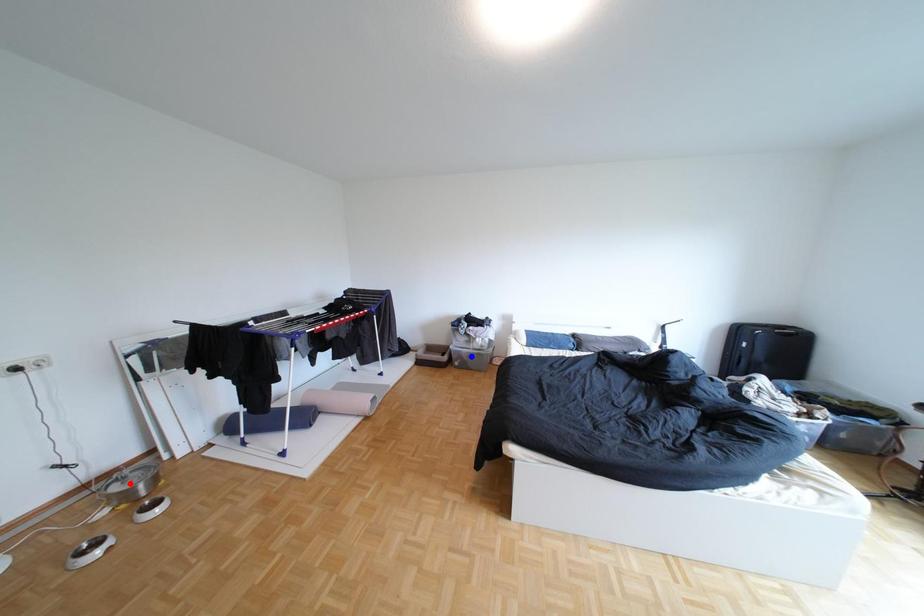
Question: In the image, two points are highlighted. Which point is nearer to the camera? Reply with the corresponding letter.

Choices:
 (A) blue point
 (B) red point

Answer: (B)